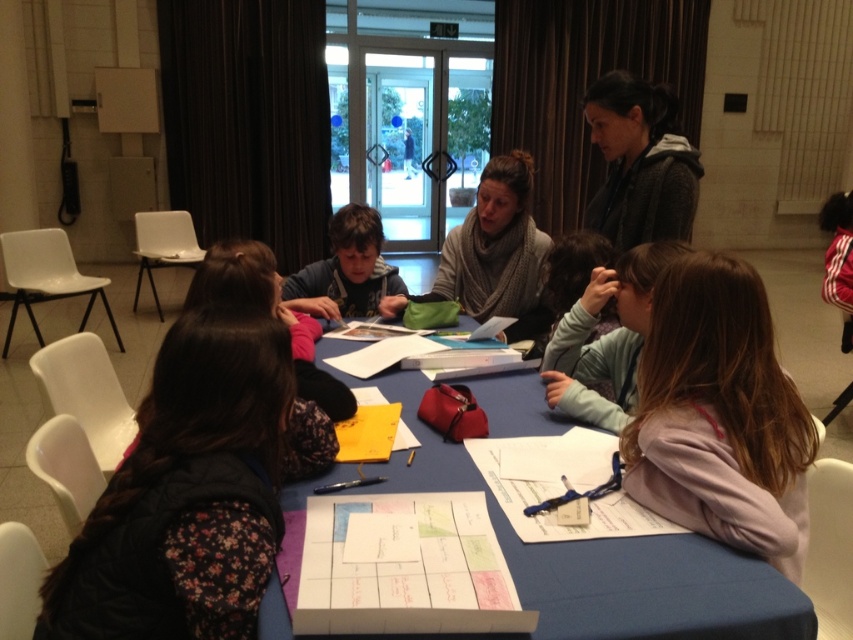
Question: Does pink fleece jacket at center appear under blue fabric table at center?

Choices:
 (A) yes
 (B) no

Answer: (B)

Question: Can you confirm if pink fleece jacket at center is positioned above blue fabric table at center?

Choices:
 (A) yes
 (B) no

Answer: (A)

Question: Among these points, which one is farthest from the camera?

Choices:
 (A) (310, 266)
 (B) (642, 417)

Answer: (A)

Question: Can you confirm if knitted scarf at center is smaller than blue fabric table at center?

Choices:
 (A) no
 (B) yes

Answer: (A)

Question: Among these points, which one is nearest to the camera?

Choices:
 (A) (541, 232)
 (B) (752, 500)

Answer: (B)

Question: Which point appears farthest from the camera in this image?

Choices:
 (A) (347, 262)
 (B) (462, 224)

Answer: (B)